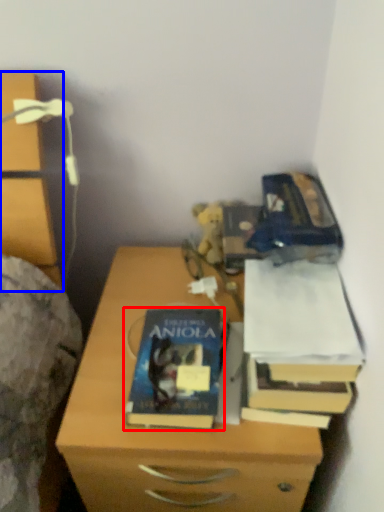
Question: Among these objects, which one is nearest to the camera, book (highlighted by a red box) or chest of drawers (highlighted by a blue box)?

Choices:
 (A) book
 (B) chest of drawers

Answer: (B)